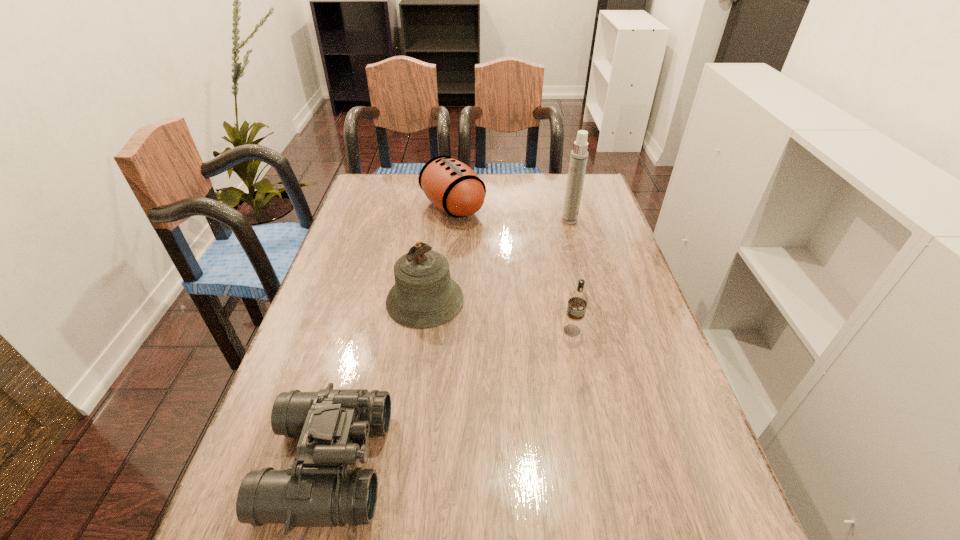
Identify the location of object that is at the right edge. (578, 160).

In the image, there is a desktop. Where is `free space at the far edge`? The image size is (960, 540). free space at the far edge is located at coordinates (421, 194).

Find the location of a particular element. The width and height of the screenshot is (960, 540). vacant region at the left edge is located at coordinates (294, 388).

Where is `vacant region at the right edge of the desktop`? The height and width of the screenshot is (540, 960). vacant region at the right edge of the desktop is located at coordinates (653, 394).

Find the location of a particular element. This screenshot has width=960, height=540. vacant space at the far left corner of the desktop is located at coordinates (407, 179).

The width and height of the screenshot is (960, 540). In order to click on vacant space at the far right corner in this screenshot , I will do `click(585, 190)`.

Identify the location of free space between the bell and the rightmost object. (497, 260).

In order to click on empty location between the second object from right to left and the football (American) in this screenshot , I will do coord(513,269).

Locate an element on the screen. The width and height of the screenshot is (960, 540). free point between the vodka and the tallest object is located at coordinates (571, 275).

Image resolution: width=960 pixels, height=540 pixels. I want to click on blank region between the football (American) and the rightmost object, so click(511, 214).